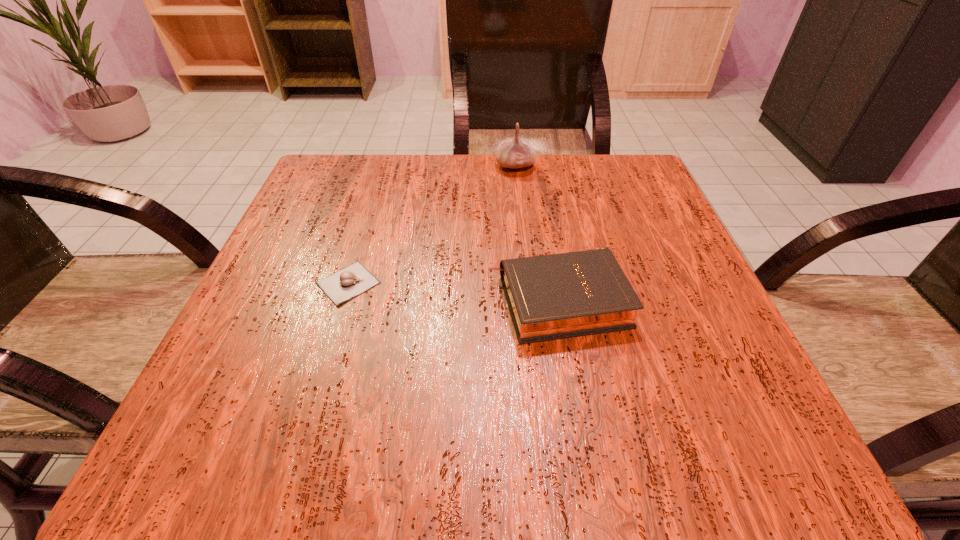
This screenshot has height=540, width=960. I want to click on object that is at the right edge, so click(x=555, y=296).

You are a GUI agent. You are given a task and a screenshot of the screen. Output one action in this format:
    pyautogui.click(x=<x>, y=<y>)
    Task: Click on the blank space at the far edge of the desktop
    Image resolution: width=960 pixels, height=540 pixels.
    Given the screenshot: What is the action you would take?
    pyautogui.click(x=427, y=163)

The image size is (960, 540). In the image, there is a desktop. In order to click on vacant space at the near edge in this screenshot , I will do `click(429, 409)`.

In the image, there is a desktop. Where is `vacant space at the left edge`? vacant space at the left edge is located at coordinates (306, 293).

The height and width of the screenshot is (540, 960). I want to click on vacant space at the right edge, so click(x=682, y=315).

Identify the location of vacant space at the far left corner. (366, 190).

Identify the location of free space at the near left corner. (282, 442).

Find the location of a particular element. free space at the far right corner of the desktop is located at coordinates (621, 184).

What are the coordinates of `free space at the near right corner of the desktop` in the screenshot? It's located at (746, 454).

Where is `empty space that is in between the nearer garlic and the tallest object`? empty space that is in between the nearer garlic and the tallest object is located at coordinates (432, 224).